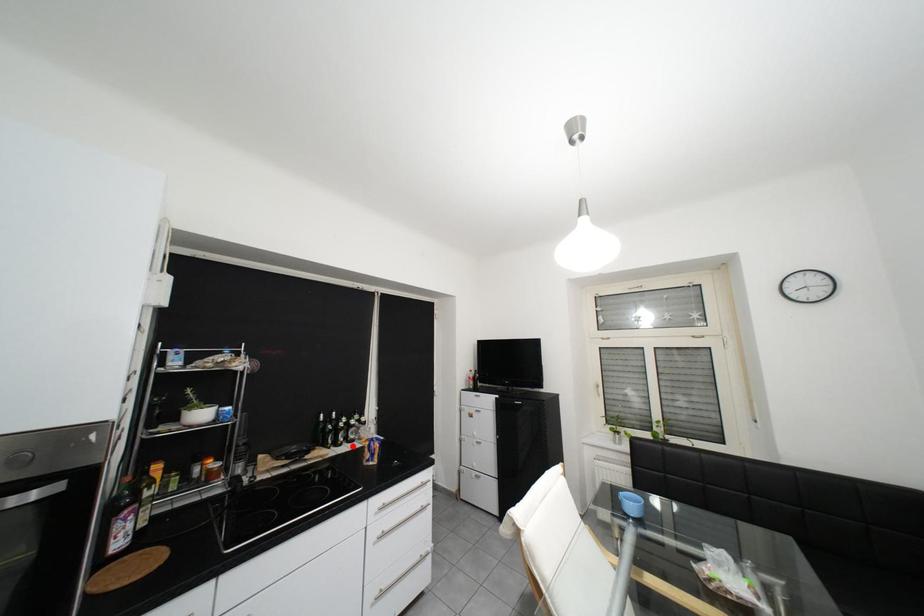
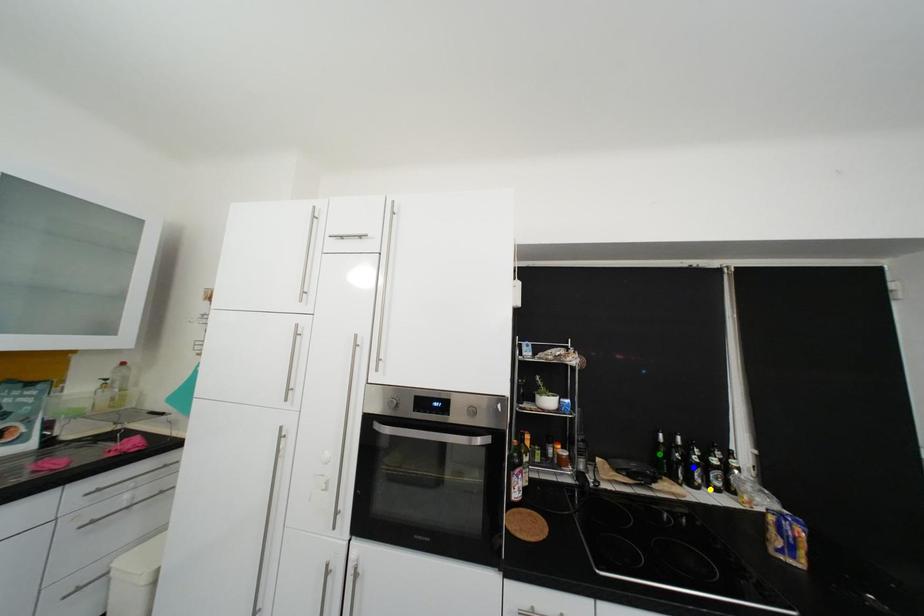
Question: I am providing you with two images of the same scene from different viewpoints. A red point is marked on the first image. You are given multiple points on the second image. Which point in image 2 represents the same 3d spot as the red point in image 1?

Choices:
 (A) yellow point
 (B) green point
 (C) blue point

Answer: (A)